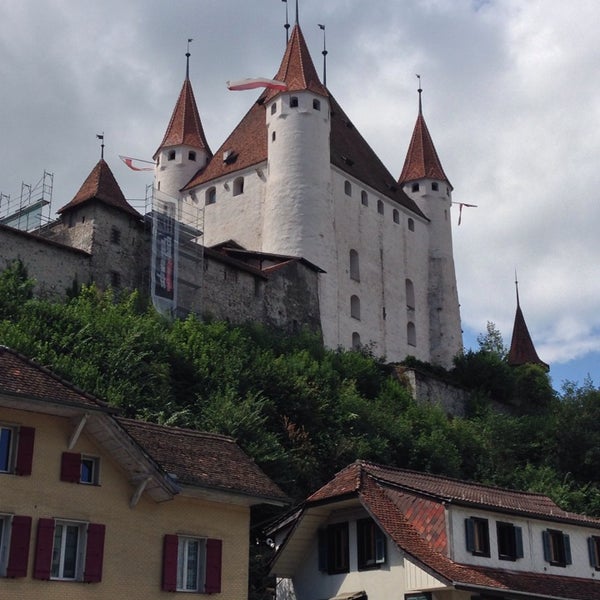
Locate an element on the screen. window is located at coordinates (481, 541).